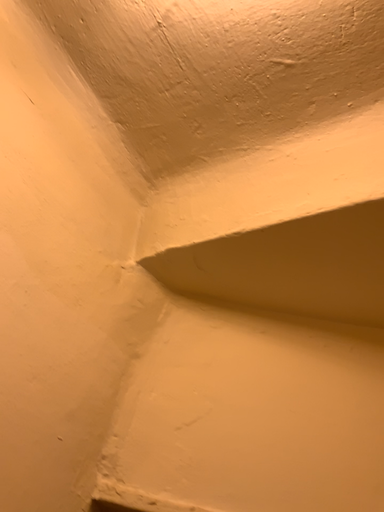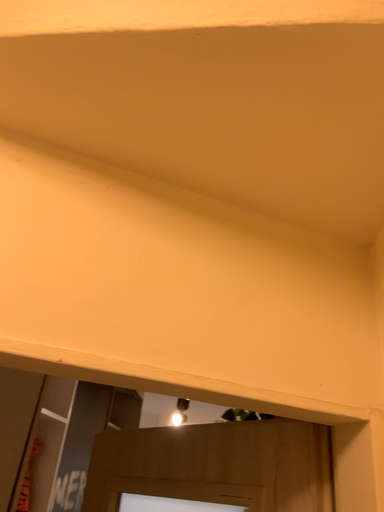
Question: Which way did the camera rotate in the video?

Choices:
 (A) rotated downward
 (B) rotated upward

Answer: (A)